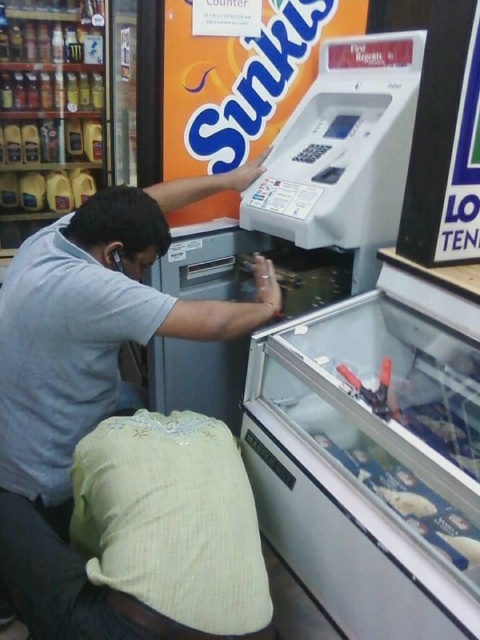
You are standing in a convenience store and need to reach both the white plastic vending machine at lower right and the light blue shirt at center. Which object is closer to you?

The white plastic vending machine at lower right is closer to you since it has a smaller size compared to the light blue shirt at center.

You are a customer in the store and want to reach the keypad of the white plastic vending machine at lower right. The light blue shirt at center is blocking your view. Can you move around the machine to get a clear view of the keypad?

The white plastic vending machine at lower right is thinner than the light blue shirt at center, so it might be difficult to move around the machine to get a clear view of the keypad since the machine is narrower than the shirt.

You are a customer in a store and want to reach the white plastic vending machine at lower right. However, there is a person wearing a light blue shirt at center blocking your path. Based on their positions, can you walk around the person to access the machine?

The white plastic vending machine at lower right is positioned under the light blue shirt at center, meaning the shirt is above the machine. Since the person is standing in front of the machine, you can walk around them to either side to access the machine.